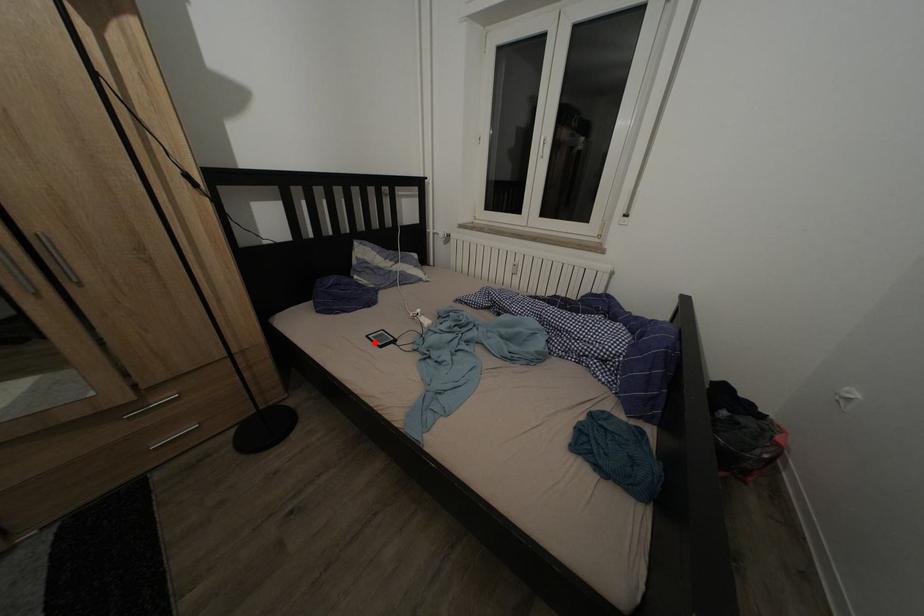
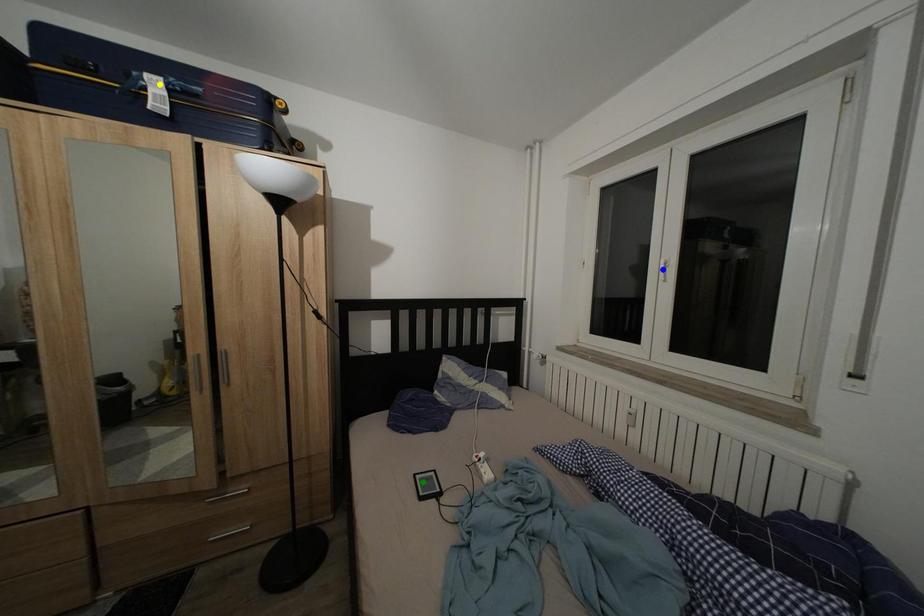
Question: I am providing you with two images of the same scene from different viewpoints. A red point is marked on the first image. You are given multiple points on the second image. In image 2, which mark is for the same physical point as the one in image 1?

Choices:
 (A) yellow point
 (B) blue point
 (C) green point

Answer: (C)